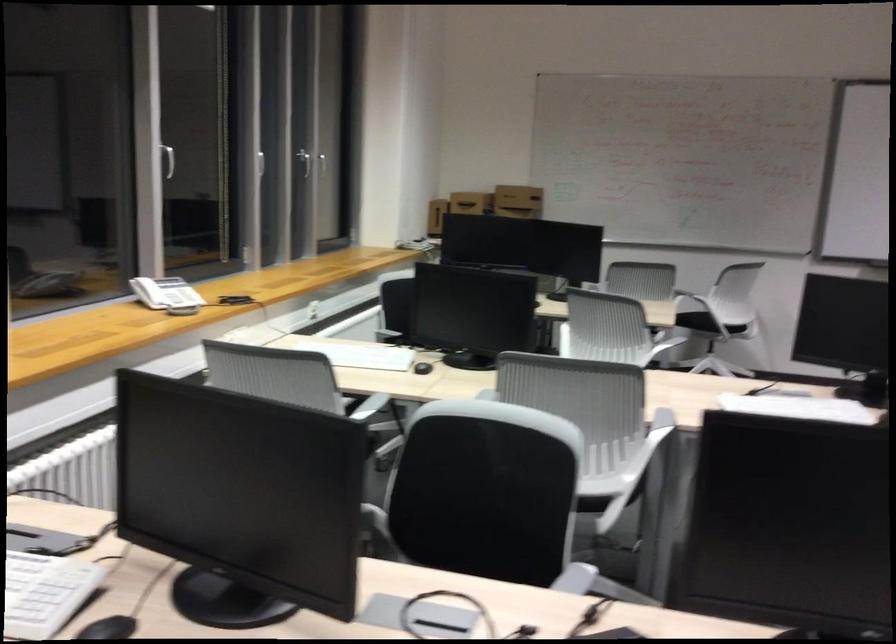
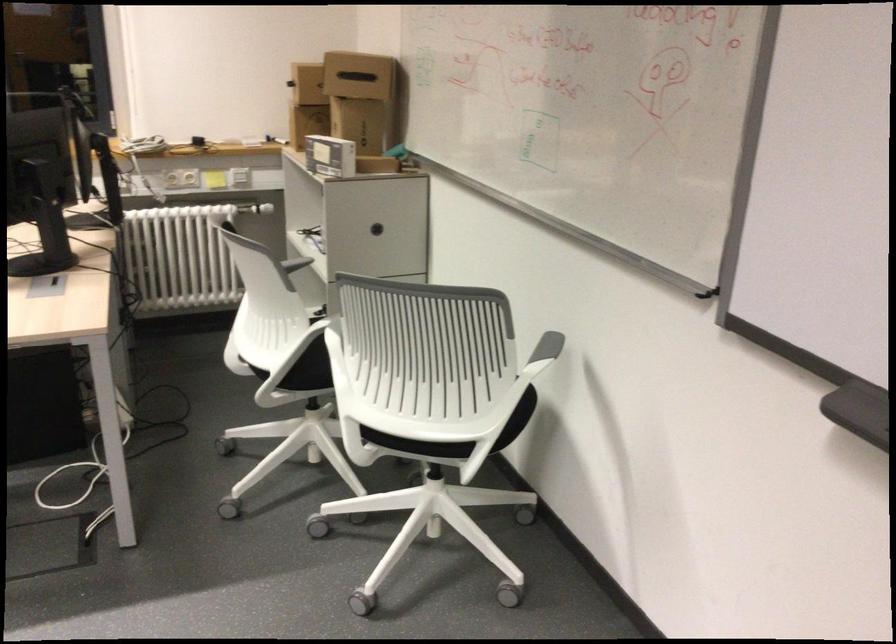
Locate, in the second image, the point that corresponds to [539,193] in the first image.

(357, 76)